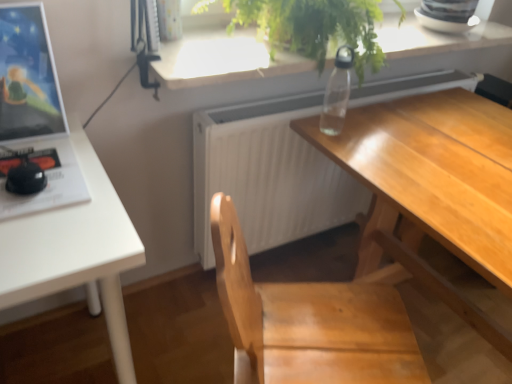
The width and height of the screenshot is (512, 384). Find the location of `free point above white matte table at left (from a real-world perspective)`. free point above white matte table at left (from a real-world perspective) is located at coordinates (51, 182).